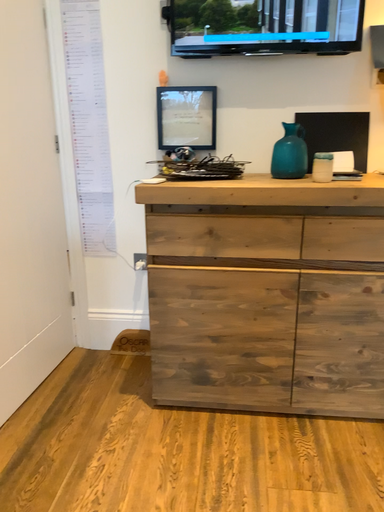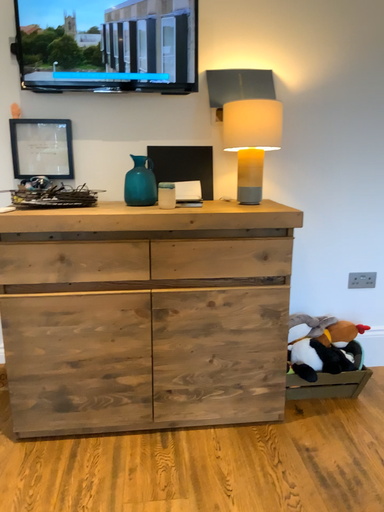
Question: How did the camera likely rotate when shooting the video?

Choices:
 (A) rotated left
 (B) rotated right

Answer: (B)